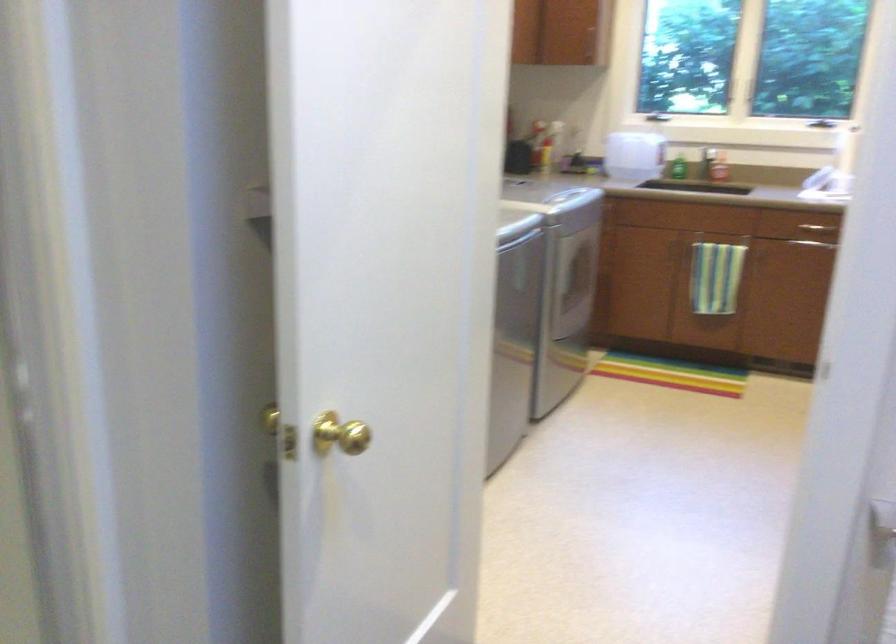
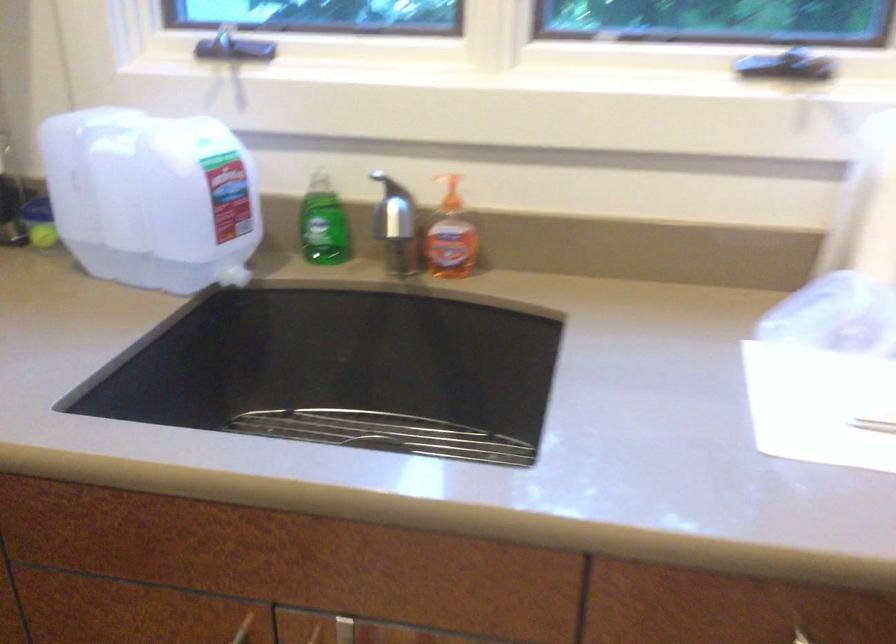
Find the pixel in the second image that matches (719,162) in the first image.

(451, 236)